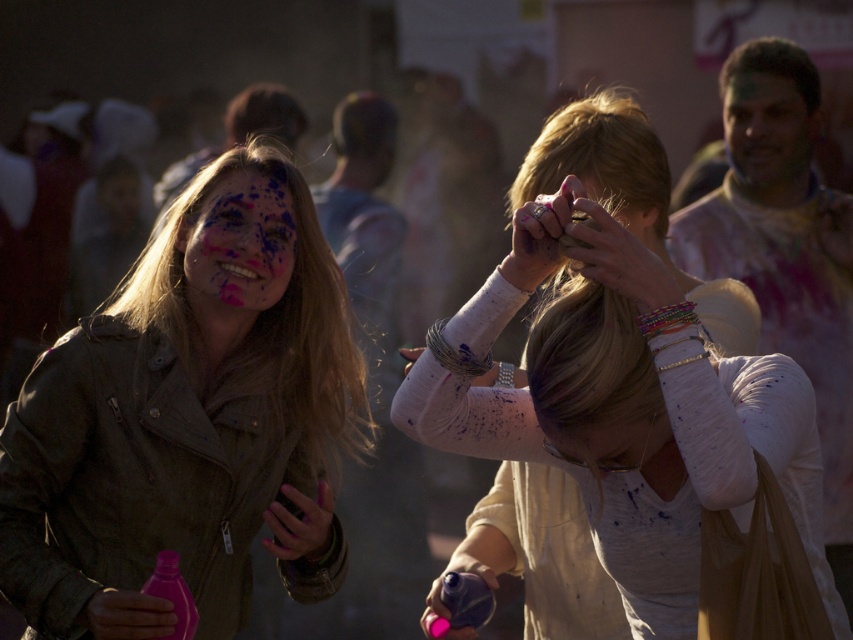
Question: Estimate the real-world distances between objects in this image. Which object is farther from the white textured sweater at center?

Choices:
 (A) matte green jacket at left
 (B) painted skin at center

Answer: (B)

Question: Does painted skin at center appear under smooth skin face at upper right?

Choices:
 (A) no
 (B) yes

Answer: (B)

Question: Which point is farther from the camera taking this photo?

Choices:
 (A) (136, 422)
 (B) (749, 160)
 (C) (265, 291)

Answer: (B)

Question: Does white textured sweater at center come in front of smooth skin face at upper right?

Choices:
 (A) yes
 (B) no

Answer: (A)

Question: Can you confirm if matte green jacket at left is smaller than white textured sweater at center?

Choices:
 (A) yes
 (B) no

Answer: (B)

Question: Which object appears farthest from the camera in this image?

Choices:
 (A) matte green jacket at left
 (B) white textured sweater at center
 (C) smooth skin face at upper right

Answer: (C)